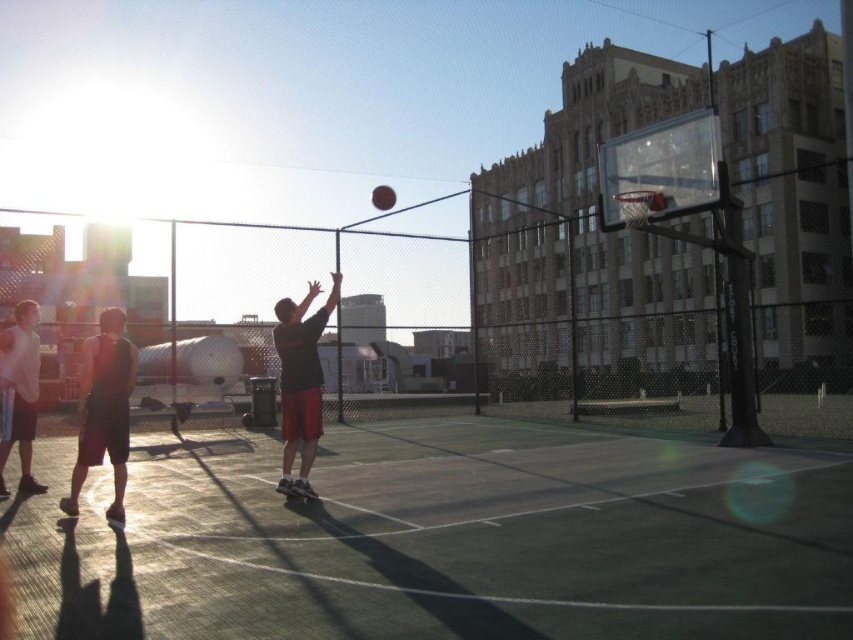
Looking at this image, does green rubber court at center have a greater height compared to matte black shirt at center?

In fact, green rubber court at center may be shorter than matte black shirt at center.

The height and width of the screenshot is (640, 853). Describe the element at coordinates (445, 541) in the screenshot. I see `green rubber court at center` at that location.

Is point (144, 444) positioned behind point (291, 445)?

Yes, point (144, 444) is behind point (291, 445).

Where is `green rubber court at center`? green rubber court at center is located at coordinates (445, 541).

Is point (299, 410) in front of point (12, 340)?

That is False.

Identify the location of matte black shirt at center. The height and width of the screenshot is (640, 853). (300, 381).

Who is higher up, black matte shorts at left or matte black shorts at left?

matte black shorts at left

Who is positioned more to the right, black matte shorts at left or matte black shorts at left?

black matte shorts at left is more to the right.

Who is more forward, (94, 340) or (0, 426)?

Point (94, 340)

Locate an element on the screen. This screenshot has width=853, height=640. black matte shorts at left is located at coordinates (103, 410).